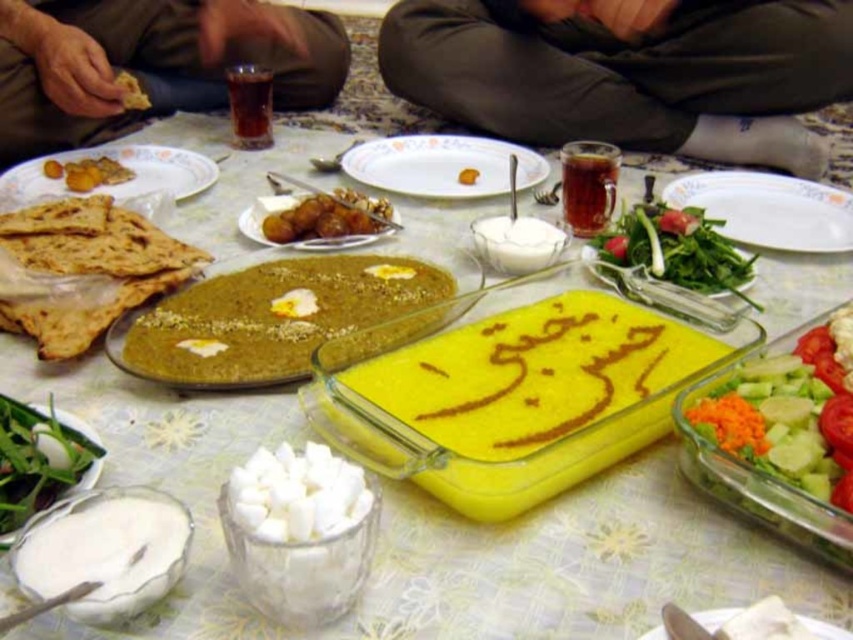
Between dark green pants at center and green leafy vegetables at lower right, which one has less height?

Standing shorter between the two is green leafy vegetables at lower right.

Is dark green pants at center taller than green leafy vegetables at lower right?

Yes.

You are a GUI agent. You are given a task and a screenshot of the screen. Output one action in this format:
    pyautogui.click(x=<x>, y=<y>)
    Task: Click on the dark green pants at center
    The width and height of the screenshot is (853, 640).
    Given the screenshot: What is the action you would take?
    pyautogui.click(x=630, y=72)

Identify the location of dark green pants at center. (630, 72).

Does dark green pants at center have a smaller size compared to golden fried pastry at upper left?

No, dark green pants at center is not smaller than golden fried pastry at upper left.

Does dark green pants at center appear over golden fried pastry at upper left?

Yes.

Does point (693, 113) come closer to viewer compared to point (100, 168)?

No, it is behind (100, 168).

Identify the location of dark green pants at center. (630, 72).

Between brown fabric pants at upper center and white porcelain plate at center, which one has less height?

With less height is white porcelain plate at center.

Who is more distant from viewer, (83, 88) or (347, 152)?

The point (347, 152) is more distant.

Where is `brown fabric pants at upper center`? The width and height of the screenshot is (853, 640). brown fabric pants at upper center is located at coordinates (149, 64).